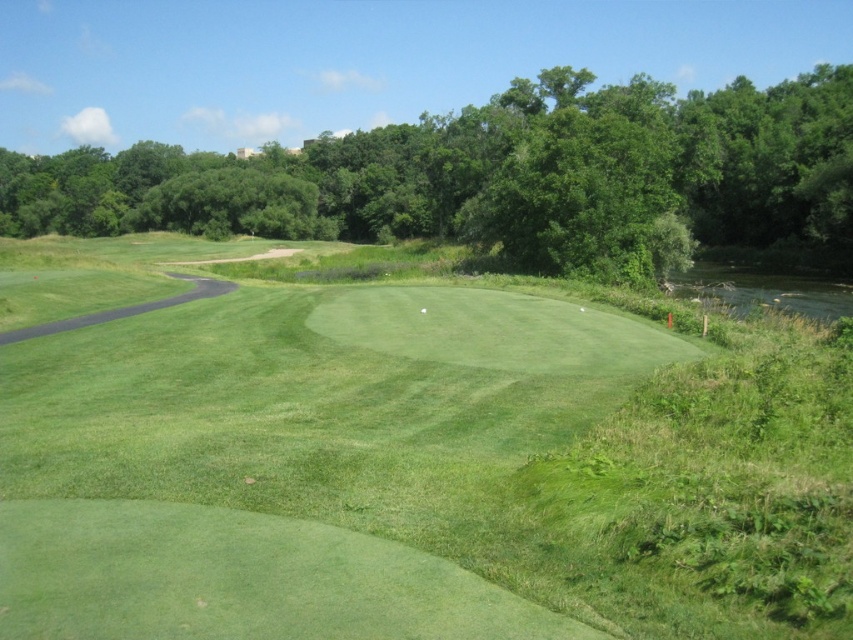
You are a golfer standing on the green grassy golf course at center. You want to hit the ball towards the green leafy tree at upper center. Will the tree block your shot if you aim directly at it?

The green grassy golf course at center is in front of the green leafy tree at upper center, so the tree is behind the golf course. Therefore, the tree will not block your shot if you aim directly at it because the golf course is between you and the tree.

You are a golfer standing on the fairway and see two points marked on the golf course. The first point is at coordinates point (222,588) and the second is at point (459,180). Which point is closer to your current position if you are facing the putting green?

Point (222,588) is in front of point (459,180), so if you are facing the putting green, the point (222,588) is closer to your current position.